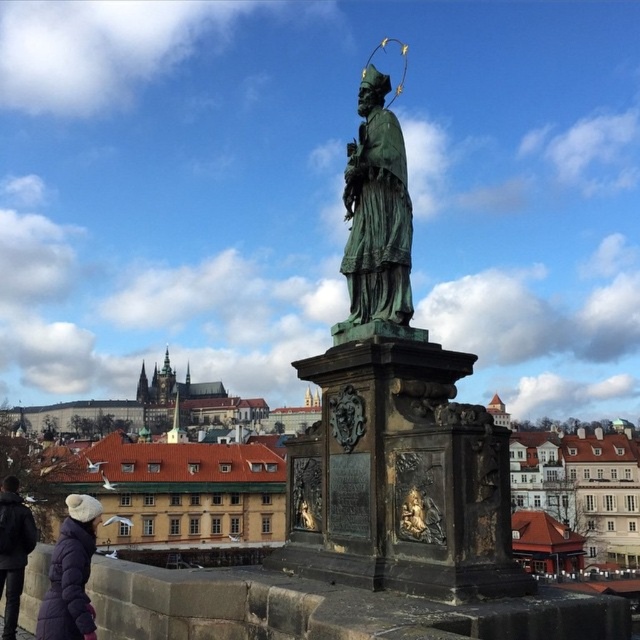
Question: Can you confirm if green polished statue at center is positioned above dark gray jacket at lower left?

Choices:
 (A) no
 (B) yes

Answer: (B)

Question: Is green polished statue at center above dark gray jacket at lower left?

Choices:
 (A) no
 (B) yes

Answer: (B)

Question: Among these objects, which one is farthest from the camera?

Choices:
 (A) green patina statue at center
 (B) purple puffy coat at lower left
 (C) dark gray jacket at lower left
 (D) green polished statue at center

Answer: (C)

Question: Which is farther from the green patina statue at center?

Choices:
 (A) dark gray jacket at lower left
 (B) green polished statue at center

Answer: (B)

Question: Which of the following is the closest to the observer?

Choices:
 (A) (4, 520)
 (B) (342, 513)
 (C) (81, 636)

Answer: (C)

Question: Does green polished statue at center appear on the left side of purple puffy coat at lower left?

Choices:
 (A) no
 (B) yes

Answer: (A)